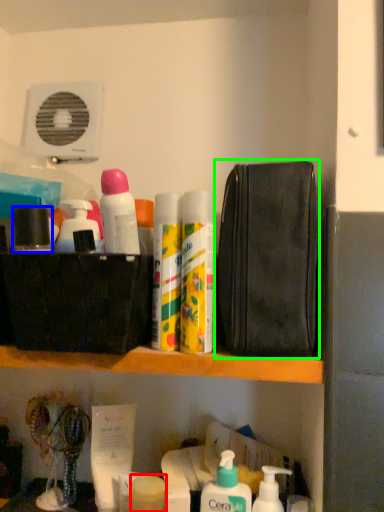
Question: Considering the real-world distances, which object is closest to toiletry (highlighted by a red box)? toiletry (highlighted by a blue box) or pouch (highlighted by a green box).

Choices:
 (A) toiletry
 (B) pouch

Answer: (B)